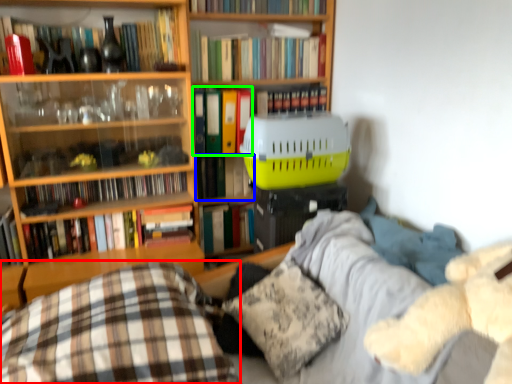
Question: Which is farther away from pillow (highlighted by a red box)? book (highlighted by a blue box) or book (highlighted by a green box)?

Choices:
 (A) book
 (B) book

Answer: (B)